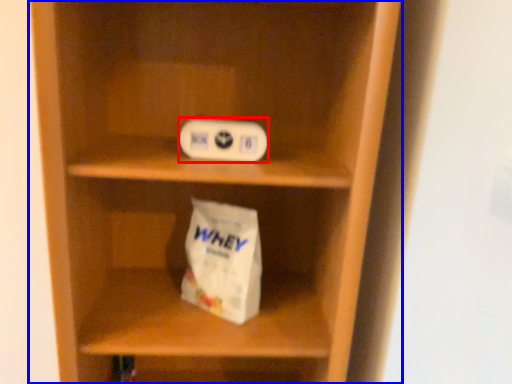
Question: Which point is further to the camera, ipod (highlighted by a red box) or shelf (highlighted by a blue box)?

Choices:
 (A) ipod
 (B) shelf

Answer: (A)